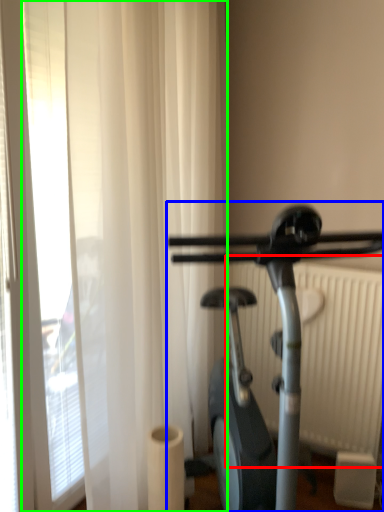
Question: Which object is the closest to the radiator (highlighted by a red box)? Choose among these: stationary bicycle (highlighted by a blue box) or shower curtain (highlighted by a green box).

Choices:
 (A) stationary bicycle
 (B) shower curtain

Answer: (B)